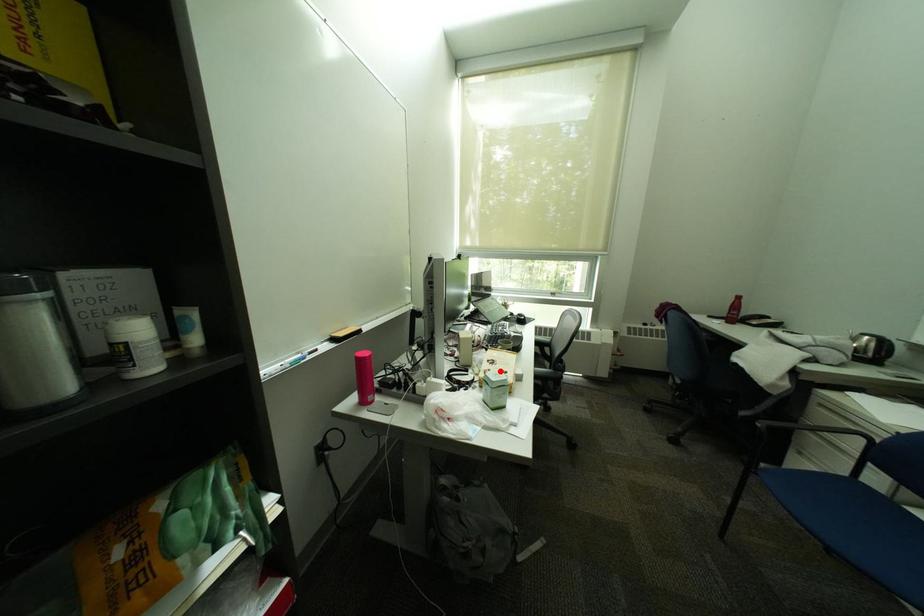
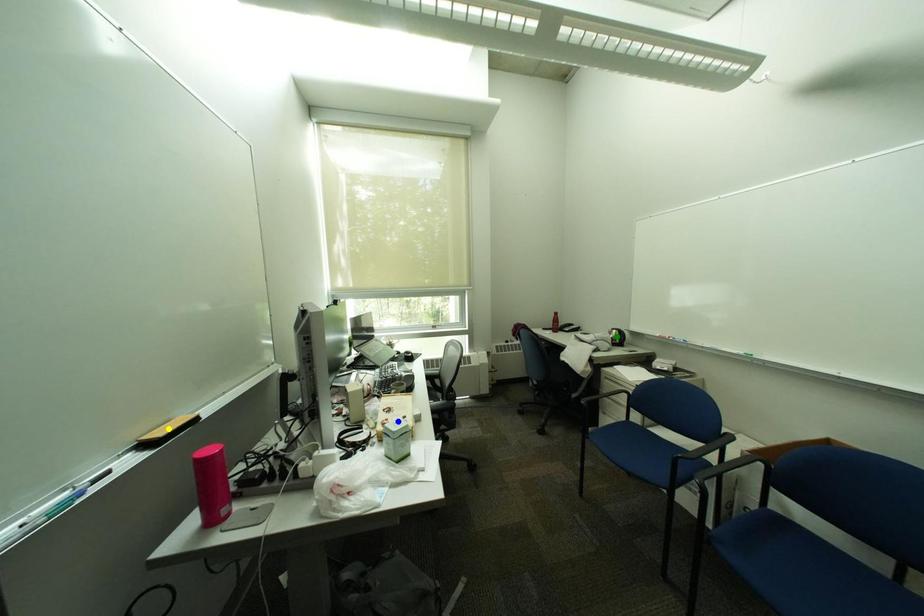
Question: I am providing you with two images of the same scene from different viewpoints. A red point is marked on the first image. You are given multiple points on the second image. In image 2, which mark is for the same physical point as the one in image 1?

Choices:
 (A) blue point
 (B) green point
 (C) yellow point

Answer: (A)